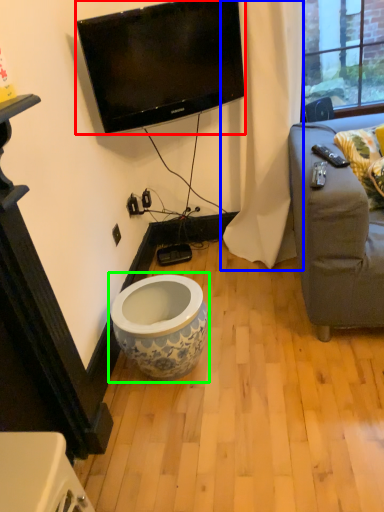
Question: Which object is positioned closest to television (highlighted by a red box)? Select from curtain (highlighted by a blue box) and toilet (highlighted by a green box).

Choices:
 (A) curtain
 (B) toilet

Answer: (A)